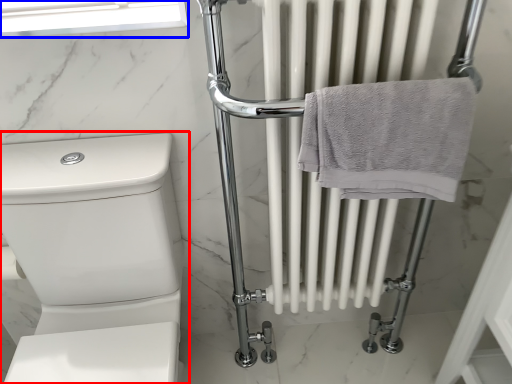
Question: Which object appears farthest to the camera in this image, toilet (highlighted by a red box) or window screen (highlighted by a blue box)?

Choices:
 (A) toilet
 (B) window screen

Answer: (B)